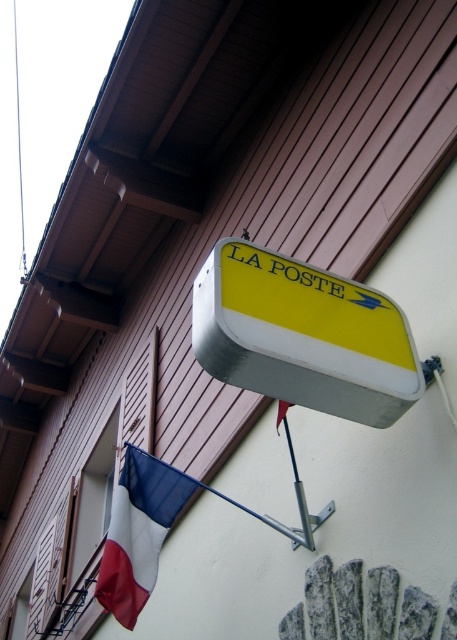
You are a delivery person approaching the building and need to see both the yellow matte sign at upper center and the tricolor fabric flag at lower left. Can you see both objects at the same time from your current position?

Yes, you can see both the yellow matte sign at upper center and the tricolor fabric flag at lower left at the same time because the yellow matte sign at upper center is in front of the tricolor fabric flag at lower left, allowing both to be visible from your position.

You are standing in front of the LA POSTE building and need to locate two specific points marked on the signboard. The first point is at coordinates point (386, 300) and the second is at point (132, 596). Which of these points is closer to you?

Point (386, 300) is in front of point (132, 596), so the first point is closer to you.

You are standing in front of a building and want to take a photo of the yellow matte sign at upper center. If your camera can focus on objects within 3 meters, will it be able to capture the sign clearly?

The yellow matte sign at upper center is 2.91 meters away from the camera, which is within the 3 meters focusing range. Therefore, the camera can capture the sign clearly.